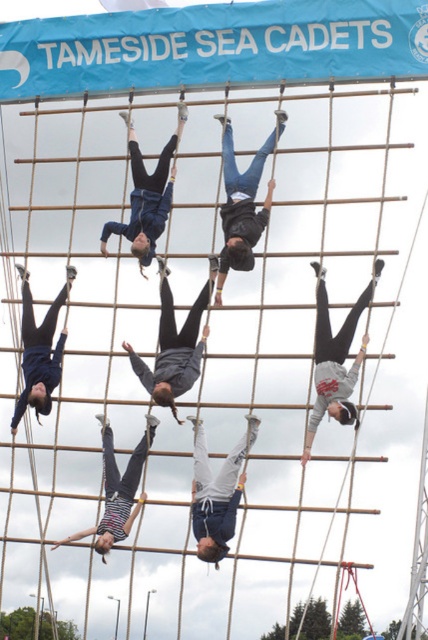
You are a photographer standing in front of the climbing frame. You want to take a photo that includes both the gray sweatshirt at center and the striped fabric pants at center. Which object should you focus on first to ensure both are in frame?

You should focus on the gray sweatshirt at center first because it is much taller than the striped fabric pants at center, so adjusting the camera angle to include its height will naturally include the lower positioned striped fabric pants at center.

You are standing in front of the climbing frame and notice a point at coordinates [335,358]. Which object is this point located on?

The point at coordinates [335,358] is located on the gray sweatshirt at center.